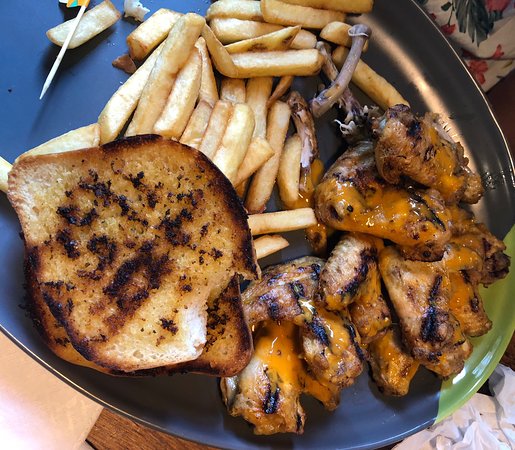
You are a GUI agent. You are given a task and a screenshot of the screen. Output one action in this format:
    pyautogui.click(x=<x>, y=<y>)
    Task: Click on the table
    The width and height of the screenshot is (515, 450).
    Given the screenshot: What is the action you would take?
    pyautogui.click(x=130, y=429)